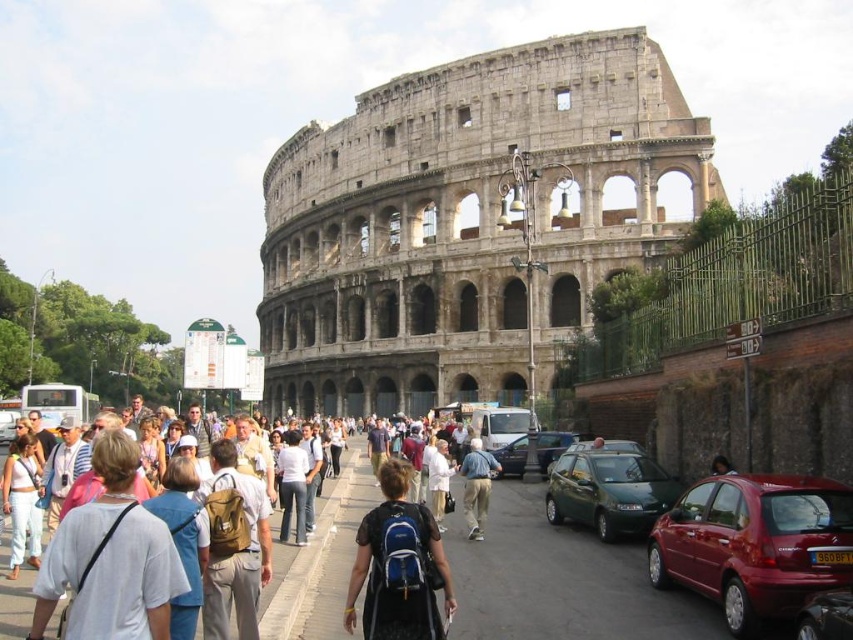
You are a photographer standing in front of the Colosseum and want to capture both the stone amphitheater at center and the white cotton shirt at center in a single photo. Which object should you focus on first to ensure both are in frame?

Since the stone amphitheater at center is larger in size than the white cotton shirt at center, you should focus on the stone amphitheater at center first to ensure it fits within the frame, allowing space for the smaller white cotton shirt at center as well.

You are a photographer standing in front of the Colosseum and want to take a picture of the stone amphitheater at center and the white cotton shirt at center. Which object should you focus on first if you want to capture both in a single frame without moving the camera?

The stone amphitheater at center is wider than the white cotton shirt at center, so you should focus on the stone amphitheater at center first to ensure it fits entirely within the frame before adjusting for the smaller white cotton shirt at center.

In the scene shown: You are standing in front of the Colosseum and need to cross the street to reach a cafe located behind the metallic red hatchback at right. Considering the hatchback is 38.93 meters away, can you safely cross the street before it reaches you?

The metallic red hatchback at right is 38.93 meters away from you. Since it is quite far, you have enough time to safely cross the street before the hatchback reaches you.